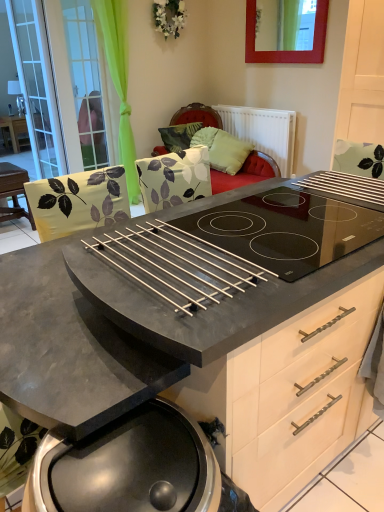
Question: Considering the relative sizes of green leaf-patterned pillow at upper center, which is counted as the 1th pillow, starting from the left, and green fabric screen door at upper left, which is counted as the 1th screen door, starting from the right, in the image provided, is green leaf-patterned pillow at upper center, which is counted as the 1th pillow, starting from the left, taller than green fabric screen door at upper left, which is counted as the 1th screen door, starting from the right,?

Choices:
 (A) no
 (B) yes

Answer: (A)

Question: Would you say green leaf-patterned pillow at upper center, which is counted as the 1th pillow, starting from the left, is outside green fabric screen door at upper left, which is counted as the 1th screen door, starting from the right?

Choices:
 (A) yes
 (B) no

Answer: (A)

Question: Is green fabric screen door at upper left, the second screen door in the left-to-right sequence, at the back of green leaf-patterned pillow at upper center, the second pillow in the right-to-left sequence?

Choices:
 (A) no
 (B) yes

Answer: (A)

Question: Is green leaf-patterned pillow at upper center, which is counted as the 1th pillow, starting from the left, wider than green fabric screen door at upper left, the second screen door in the left-to-right sequence?

Choices:
 (A) no
 (B) yes

Answer: (B)

Question: Is green leaf-patterned pillow at upper center, which is counted as the 1th pillow, starting from the left, thinner than green fabric screen door at upper left, the second screen door in the left-to-right sequence?

Choices:
 (A) yes
 (B) no

Answer: (B)

Question: Considering the positions of green fabric screen door at upper left, which is counted as the 1th screen door, starting from the right, and green fabric pillow at center, the 2th pillow viewed from the left, in the image, is green fabric screen door at upper left, which is counted as the 1th screen door, starting from the right, taller or shorter than green fabric pillow at center, the 2th pillow viewed from the left,?

Choices:
 (A) tall
 (B) short

Answer: (A)

Question: Visually, is green fabric screen door at upper left, the second screen door in the left-to-right sequence, positioned to the left or to the right of green fabric pillow at center, the 2th pillow viewed from the left?

Choices:
 (A) left
 (B) right

Answer: (A)

Question: From a real-world perspective, is green fabric screen door at upper left, which is counted as the 1th screen door, starting from the right, positioned above or below green fabric pillow at center, positioned as the 1th pillow in right-to-left order?

Choices:
 (A) above
 (B) below

Answer: (A)

Question: Considering their positions, is green fabric screen door at upper left, the second screen door in the left-to-right sequence, located in front of or behind green fabric pillow at center, positioned as the 1th pillow in right-to-left order?

Choices:
 (A) behind
 (B) front

Answer: (B)

Question: In terms of width, does transparent glass screen door at left, which is the second screen door in right-to-left order, look wider or thinner when compared to green fabric pillow at center, the 2th pillow viewed from the left?

Choices:
 (A) thin
 (B) wide

Answer: (A)

Question: Considering the relative positions of transparent glass screen door at left, which is the second screen door in right-to-left order, and green fabric pillow at center, the 2th pillow viewed from the left, in the image provided, is transparent glass screen door at left, which is the second screen door in right-to-left order, to the left or to the right of green fabric pillow at center, the 2th pillow viewed from the left,?

Choices:
 (A) left
 (B) right

Answer: (A)

Question: Based on their sizes in the image, would you say transparent glass screen door at left, which is the second screen door in right-to-left order, is bigger or smaller than green fabric pillow at center, positioned as the 1th pillow in right-to-left order?

Choices:
 (A) big
 (B) small

Answer: (A)

Question: From the image's perspective, is transparent glass screen door at left, which is the second screen door in right-to-left order, positioned above or below green fabric pillow at center, the 2th pillow viewed from the left?

Choices:
 (A) below
 (B) above

Answer: (B)

Question: Is green fabric screen door at upper left, the second screen door in the left-to-right sequence, wider or thinner than matte black table at left, which is counted as the second table, starting from the right?

Choices:
 (A) thin
 (B) wide

Answer: (A)

Question: From the image's perspective, is green fabric screen door at upper left, which is counted as the 1th screen door, starting from the right, located above or below matte black table at left, acting as the second table starting from the front?

Choices:
 (A) below
 (B) above

Answer: (A)